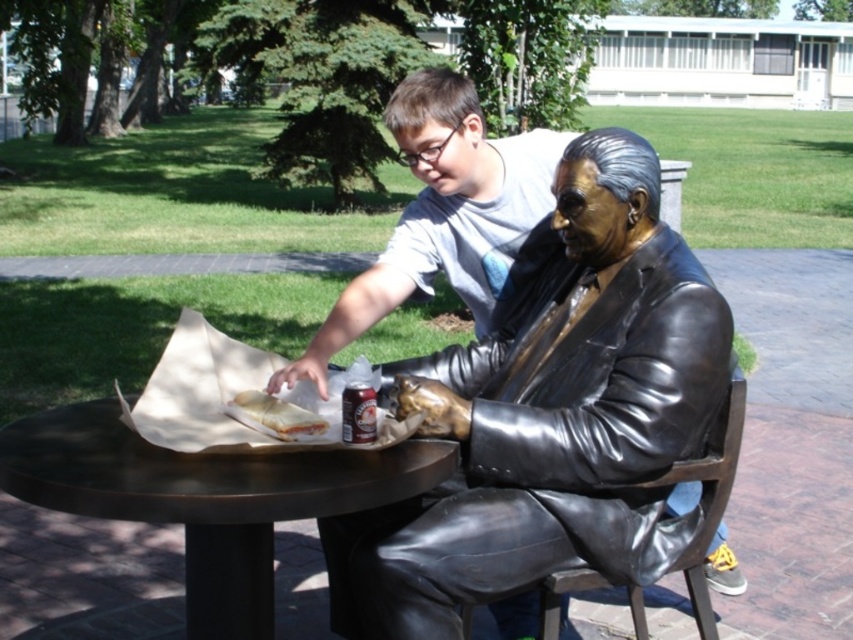
You are a photographer positioned at the origin point of the image coordinate system. You want to take a photo of the bronze metallic table at center. What are the coordinates where you should aim your camera?

The bronze metallic table at center is located at coordinates point [206,497].

You are a visitor at the park and want to take a photo of the bronze statue at center and the bronze metallic table at center together. Which object should you position closer to the camera to ensure both are in the frame?

The bronze statue at center is to the right of bronze metallic table at center. To include both in the frame, position the bronze statue at center closer to the camera since it is farther away from the table, ensuring both are visible.

You are a delivery person who needs to place a small package on the bronze metallic table at center without blocking the metallic silver can at table. Based on the scene, where should you place the package?

The bronze metallic table at center is positioned on the left side of metallic silver can at table, so placing the package to the right of the metallic silver can at table would keep it from blocking the can.